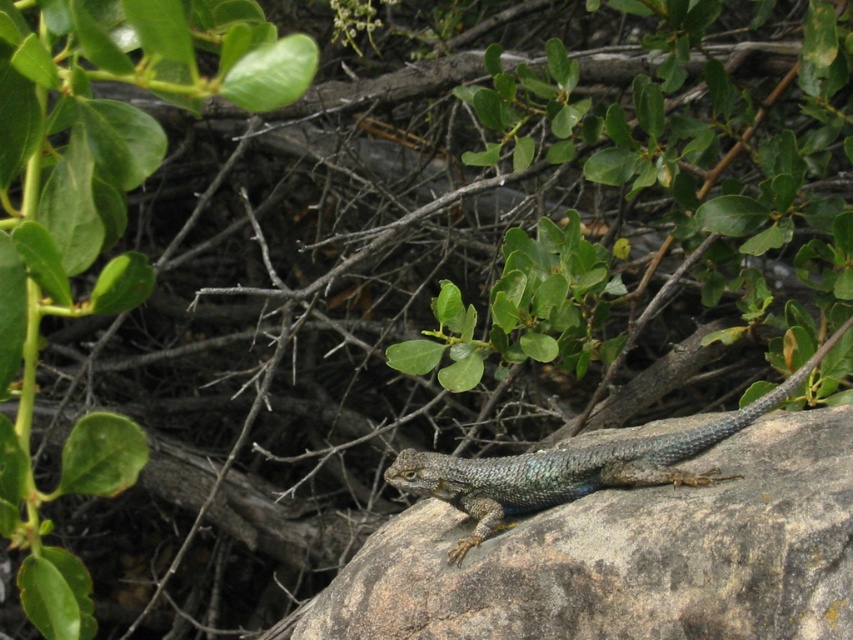
You are a hiker trying to determine the best spot to place your backpack. You see the rough textured rock at center and the green leafy plant at upper left. Which object would be more stable to place your backpack on?

The rough textured rock at center is more stable than the green leafy plant at upper left because rocks are generally more sturdy and solid compared to plants.

You are standing 5 feet away from a point marked at coordinates point (x=689, y=545) in the image. You want to place a small pebble exactly at that point. Can you reach it without moving closer than your current position?

The distance of point (x=689, y=545) from viewer is 4.73 feet. Since you are currently 5 feet away, you need to move 0.27 feet closer to reach it.

You are an ecologist studying the habitat of the shiny blue lizard at center. You notice a green leafy plant at upper left nearby. Which object takes up more area in the image?

The shiny blue lizard at center occupies more area than the green leafy plant at upper left.